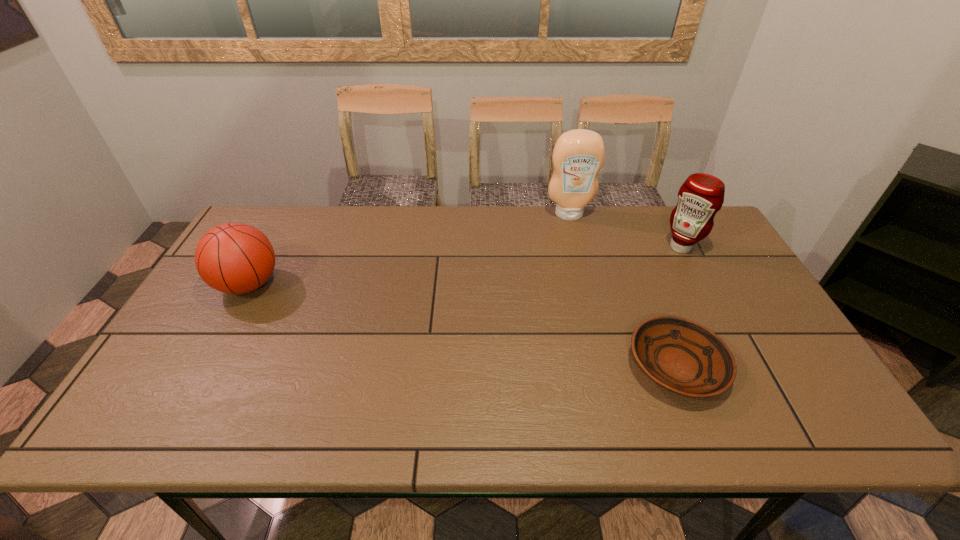
I want to click on free space between the taller condiment and the right condiment, so click(625, 231).

The height and width of the screenshot is (540, 960). What are the coordinates of `free space between the basketball and the taller condiment` in the screenshot? It's located at (409, 249).

Where is `vacant area that lies between the plate and the taller condiment`? The width and height of the screenshot is (960, 540). vacant area that lies between the plate and the taller condiment is located at coordinates (623, 290).

In order to click on vacant area that lies between the plate and the nearer condiment in this screenshot , I will do `click(679, 306)`.

Where is `empty space between the plate and the second farthest object`? The height and width of the screenshot is (540, 960). empty space between the plate and the second farthest object is located at coordinates (679, 306).

The width and height of the screenshot is (960, 540). What are the coordinates of `unoccupied area between the right condiment and the shortest object` in the screenshot? It's located at (679, 306).

In order to click on free point between the tallest object and the shortest object in this screenshot , I will do tap(623, 290).

Where is `vacant area between the nearer condiment and the plate`? The height and width of the screenshot is (540, 960). vacant area between the nearer condiment and the plate is located at coordinates (679, 306).

Image resolution: width=960 pixels, height=540 pixels. In order to click on free space between the second tallest object and the tallest object in this screenshot , I will do `click(625, 231)`.

Find the location of a particular element. The image size is (960, 540). object that ranks as the third closest to the farther condiment is located at coordinates (234, 258).